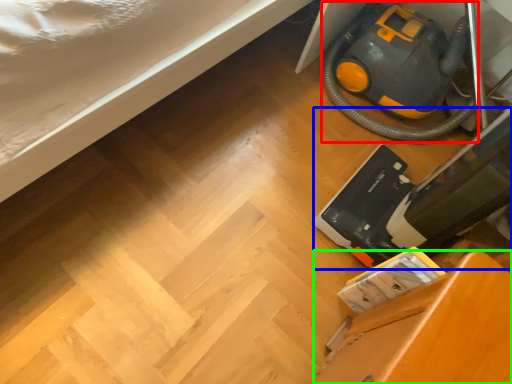
Question: Estimate the real-world distances between objects in this image. Which object is farther from equipment (highlighted by a red box), equipment (highlighted by a blue box) or furniture (highlighted by a green box)?

Choices:
 (A) equipment
 (B) furniture

Answer: (B)